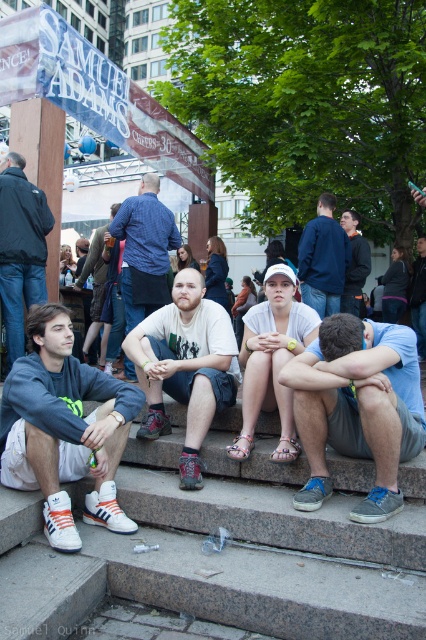
You are standing at the back of the stone steps where the four people are sitting. You want to hand a flyer to the person wearing the blue denim jacket at center without disturbing the person in the blue denim jeans at center. Is this possible based on their positions?

The blue denim jacket at center is in front of the blue denim jeans at center, so you can hand the flyer to the person wearing the blue denim jacket at center without disturbing the person in the blue denim jeans at center because the jacket is positioned closer to you.